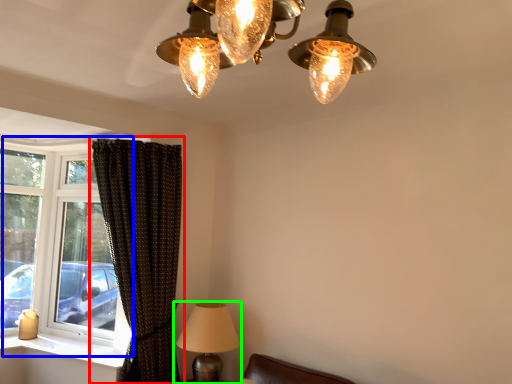
Question: Which object is the closest to the curtain (highlighted by a red box)? Choose among these: window (highlighted by a blue box) or lamp (highlighted by a green box).

Choices:
 (A) window
 (B) lamp

Answer: (B)